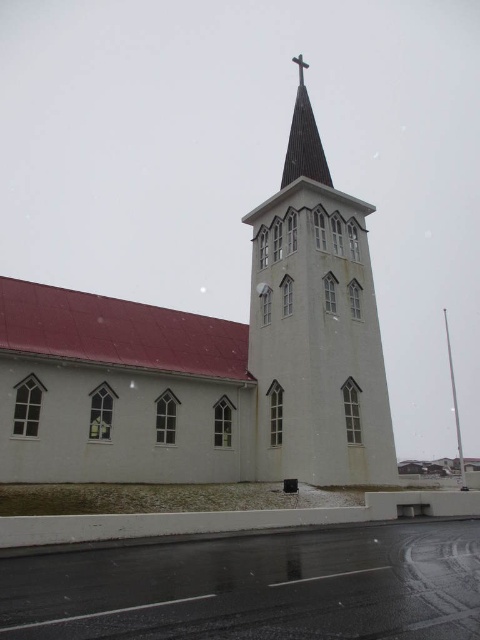
Question: Is white matte church at center positioned in front of dark brown wood steeple at upper center?

Choices:
 (A) yes
 (B) no

Answer: (A)

Question: Which of these objects is positioned farthest from the white smooth steeple at center?

Choices:
 (A) dark brown wood steeple at upper center
 (B) metallic cross at upper center
 (C) white matte church at center

Answer: (B)

Question: Is dark brown wood steeple at upper center thinner than metallic cross at upper center?

Choices:
 (A) no
 (B) yes

Answer: (A)

Question: Which object appears closest to the camera in this image?

Choices:
 (A) white matte church at center
 (B) white smooth steeple at center

Answer: (A)

Question: Which object appears farthest from the camera in this image?

Choices:
 (A) white smooth steeple at center
 (B) white matte church at center

Answer: (A)

Question: Is white matte church at center to the right of white smooth steeple at center from the viewer's perspective?

Choices:
 (A) yes
 (B) no

Answer: (B)